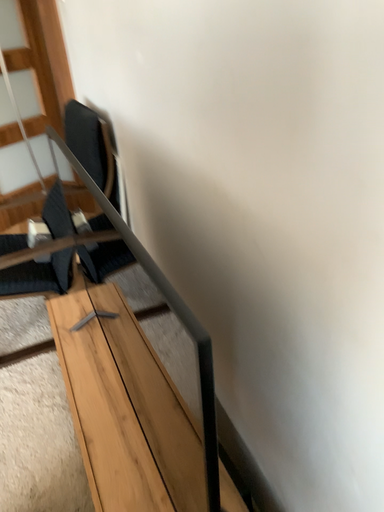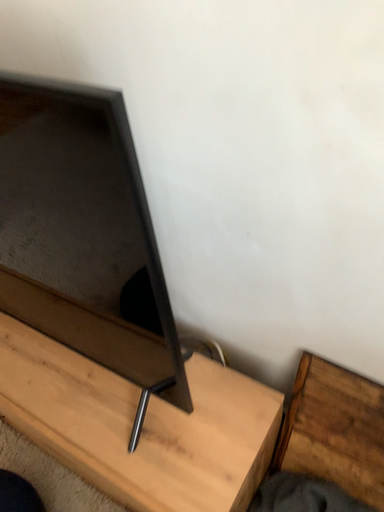
Question: How did the camera likely rotate when shooting the video?

Choices:
 (A) rotated right
 (B) rotated left

Answer: (A)